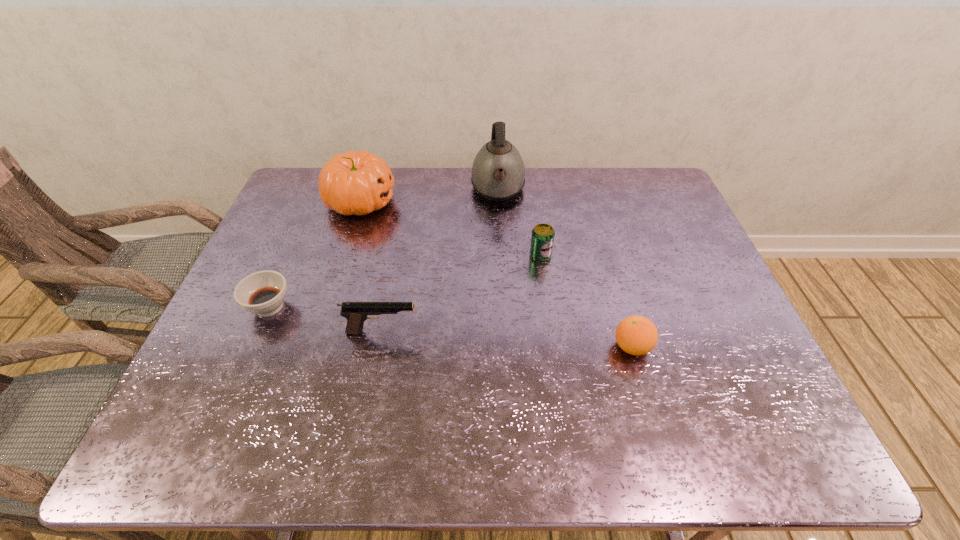
At what (x,y) coordinates should I click in order to perform the action: click on free location that satisfies the following two spatial constraints: 1. on the carved face of the beer can; 2. on the left side of the fifth shortest object. Please return your answer as a coordinate pair (x, y). The image size is (960, 540). Looking at the image, I should click on (344, 255).